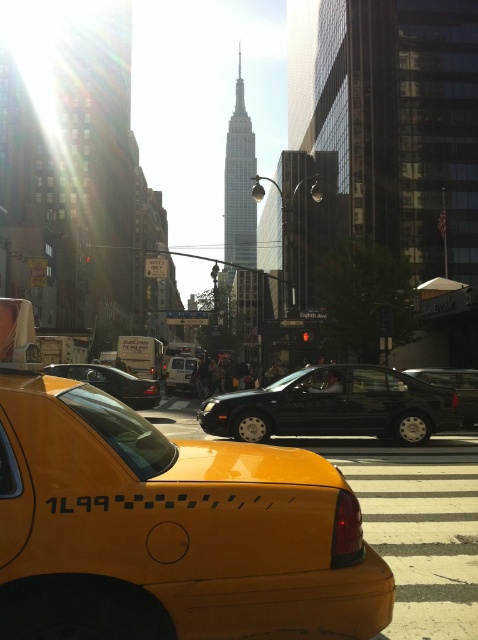
Is yellow plastic taxi at center smaller than black matte sedan at center?

Correct, yellow plastic taxi at center occupies less space than black matte sedan at center.

Is yellow plastic taxi at center bigger than black matte sedan at center?

No, yellow plastic taxi at center is not bigger than black matte sedan at center.

Between point (172, 445) and point (351, 380), which one is positioned in front?

Positioned in front is point (172, 445).

Locate an element on the screen. Image resolution: width=478 pixels, height=640 pixels. yellow plastic taxi at center is located at coordinates (165, 524).

What do you see at coordinates (335, 406) in the screenshot? The height and width of the screenshot is (640, 478). I see `black matte sedan at center` at bounding box center [335, 406].

Is black matte sedan at center positioned at the back of black rubber sedan at center?

No.

Does point (332, 374) lie behind point (459, 404)?

That is False.

This screenshot has width=478, height=640. In order to click on black matte sedan at center in this screenshot , I will do `click(335, 406)`.

This screenshot has height=640, width=478. I want to click on yellow plastic taxi at center, so click(165, 524).

Does yellow plastic taxi at center appear on the left side of shiny silver sedan at center?

No, yellow plastic taxi at center is not to the left of shiny silver sedan at center.

Who is more forward, (249, 541) or (108, 380)?

Point (249, 541) is in front.

Locate an element on the screen. yellow plastic taxi at center is located at coordinates (165, 524).